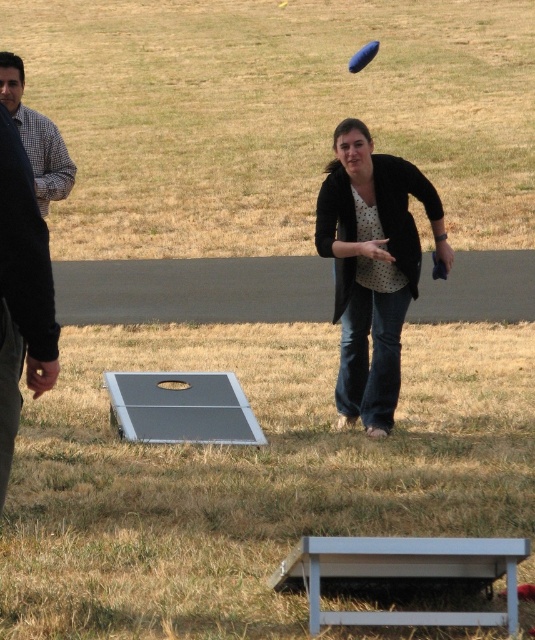
Is metallic gray board at center closer to camera compared to smooth gray board at center?

Yes, it is.

Can you confirm if metallic gray board at center is shorter than smooth gray board at center?

Indeed, metallic gray board at center has a lesser height compared to smooth gray board at center.

Between point (101, 564) and point (120, 202), which one is positioned in front?

Point (101, 564) is more forward.

Find the location of `metallic gray board at center`. metallic gray board at center is located at coordinates (251, 476).

How much distance is there between polka dot blouse at center and blue rubber frisbee at upper center?

22.92 meters

Where is `polka dot blouse at center`? The width and height of the screenshot is (535, 640). polka dot blouse at center is located at coordinates (371, 266).

The width and height of the screenshot is (535, 640). What do you see at coordinates (371, 266) in the screenshot? I see `polka dot blouse at center` at bounding box center [371, 266].

Identify the location of polka dot blouse at center. The height and width of the screenshot is (640, 535). (371, 266).

Where is `metallic gray board at center`? metallic gray board at center is located at coordinates (251, 476).

Is metallic gray board at center closer to camera compared to checkered fabric shirt at left?

That is True.

Between point (139, 609) and point (49, 147), which one is positioned behind?

Positioned behind is point (49, 147).

At what (x,y) coordinates should I click in order to perform the action: click on metallic gray board at center. Please return your answer as a coordinate pair (x, y). Looking at the image, I should click on [251, 476].